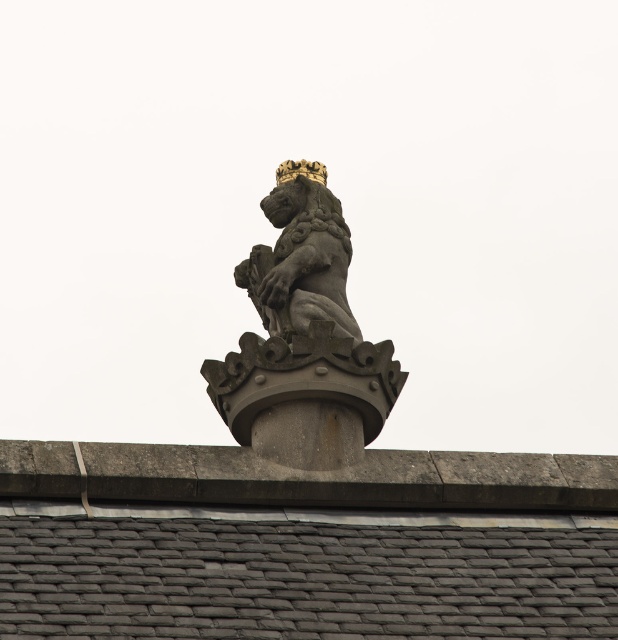
Measure the distance from gray slate roof at center to polished stone lion at center.

The distance of gray slate roof at center from polished stone lion at center is 14.92 meters.

Can you confirm if gray slate roof at center is positioned below polished stone lion at center?

Indeed, gray slate roof at center is positioned under polished stone lion at center.

Describe the element at coordinates (305, 544) in the screenshot. I see `gray slate roof at center` at that location.

Where is `gray slate roof at center`? The width and height of the screenshot is (618, 640). gray slate roof at center is located at coordinates (305, 544).

Is gray slate roof at center taller than dark gray stone lion at center?

In fact, gray slate roof at center may be shorter than dark gray stone lion at center.

Between point (22, 602) and point (255, 268), which one is positioned behind?

Positioned behind is point (255, 268).

At what (x,y) coordinates should I click in order to perform the action: click on gray slate roof at center. Please return your answer as a coordinate pair (x, y). The image size is (618, 640). Looking at the image, I should click on (305, 544).

Which of these two, dark gray stone lion at center or polished stone lion at center, stands shorter?

With less height is polished stone lion at center.

Which is in front, point (331, 380) or point (286, 316)?

Point (331, 380) is more forward.

Identify the location of dark gray stone lion at center. The image size is (618, 640). (303, 339).